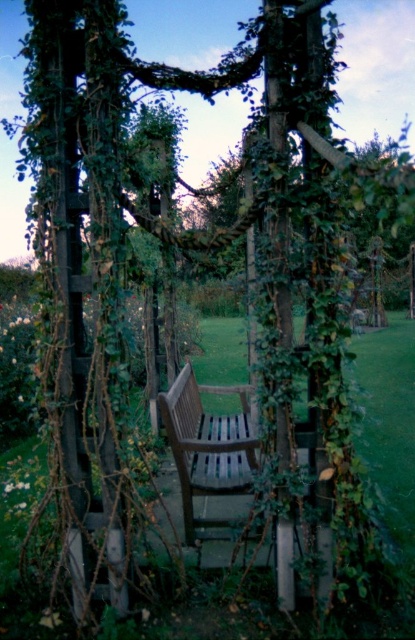
Question: Which of the following is the closest to the observer?

Choices:
 (A) (205, 534)
 (B) (403, 368)

Answer: (A)

Question: Can you confirm if green grass at center is wider than wooden bench at center?

Choices:
 (A) no
 (B) yes

Answer: (B)

Question: Is green grass at center to the right of wooden bench at center from the viewer's perspective?

Choices:
 (A) no
 (B) yes

Answer: (B)

Question: Is green grass at center smaller than wooden bench at center?

Choices:
 (A) yes
 (B) no

Answer: (B)

Question: Which object is farther from the camera taking this photo?

Choices:
 (A) green grass at center
 (B) wooden bench at center

Answer: (B)